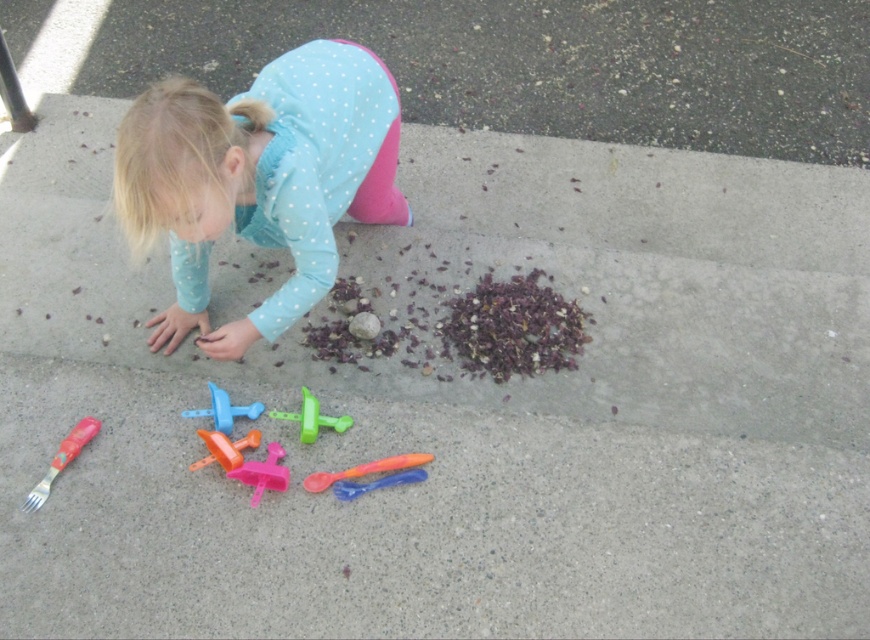
Question: From the image, what is the correct spatial relationship of pink plastic toy at lower center in relation to green plastic spoon at lower center?

Choices:
 (A) above
 (B) below

Answer: (B)

Question: Which point appears farthest from the camera in this image?

Choices:
 (A) (275, 481)
 (B) (253, 113)
 (C) (423, 460)
 (D) (44, 476)

Answer: (D)

Question: Which point is farther to the camera?

Choices:
 (A) 295,416
 (B) 332,486
 (C) 42,496
 (D) 283,324

Answer: (A)

Question: Is orange plastic spoon at lower center thinner than blue plastic shovel at lower center?

Choices:
 (A) yes
 (B) no

Answer: (B)

Question: Which point is closer to the camera?

Choices:
 (A) (255, 100)
 (B) (239, 460)

Answer: (A)

Question: Does green plastic spoon at lower center come in front of blue plastic shovel at lower center?

Choices:
 (A) yes
 (B) no

Answer: (A)